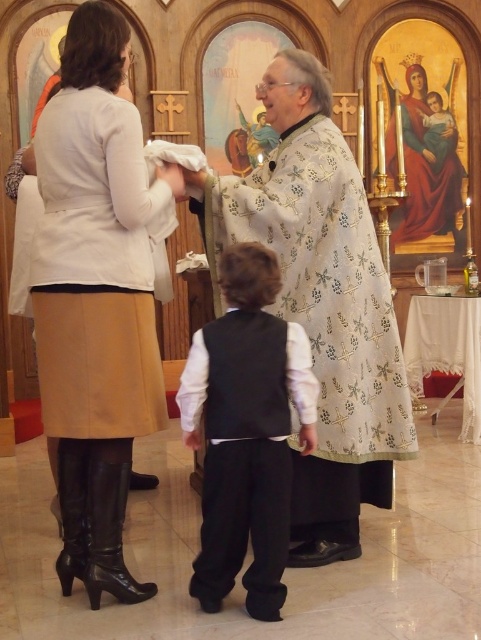
You are standing in the church and want to get to the point marked at coordinates (288,100). If you can walk 3 feet per second, how many seconds will it take you to reach that point?

The point at coordinates (288,100) is 11.14 feet away from the viewer. At a walking speed of 3 feet per second, it will take approximately 3.71 seconds to reach the point.

You are an interior designer observing the church scene. You need to determine the spatial relationship between the matte beige skirt at lower left and the black satin vest at center. Which object is positioned higher in the image?

The matte beige skirt at lower left is above the black satin vest at center, so the matte beige skirt at lower left is positioned higher in the image.